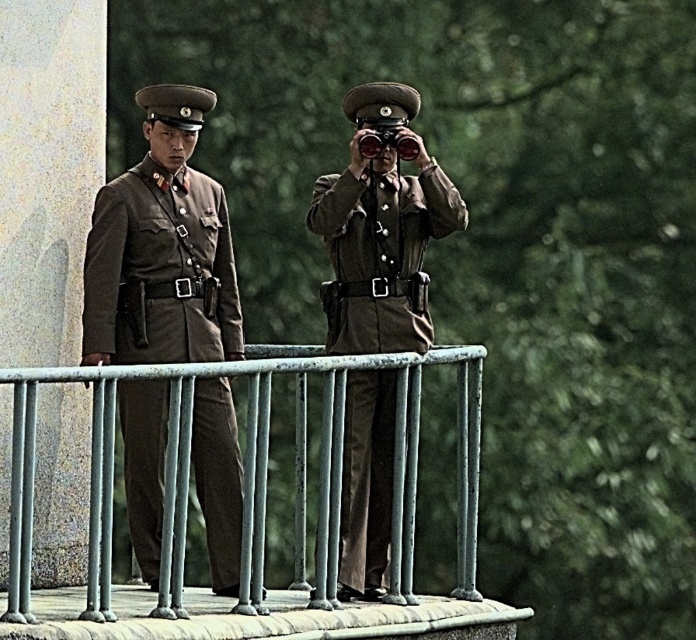
How far apart are metallic gray fence at center and matte brown uniform at center?

metallic gray fence at center is 19.99 feet from matte brown uniform at center.

Does metallic gray fence at center appear on the left side of matte brown uniform at center?

Indeed, metallic gray fence at center is positioned on the left side of matte brown uniform at center.

Between point (251, 404) and point (386, 280), which one is positioned in front?

Point (251, 404)

Locate an element on the screen. The height and width of the screenshot is (640, 696). metallic gray fence at center is located at coordinates (345, 468).

Describe the element at coordinates (159, 269) in the screenshot. I see `matte olive-green uniform at left` at that location.

Which is more to the left, matte olive-green uniform at left or matte brown uniform at center?

From the viewer's perspective, matte olive-green uniform at left appears more on the left side.

Describe the element at coordinates (159, 269) in the screenshot. I see `matte olive-green uniform at left` at that location.

Identify the location of matte olive-green uniform at left. The width and height of the screenshot is (696, 640). (159, 269).

Which is behind, point (106, 429) or point (411, 157)?

Positioned behind is point (411, 157).

Can you confirm if metallic gray fence at center is thinner than matte black binoculars at center?

In fact, metallic gray fence at center might be wider than matte black binoculars at center.

The width and height of the screenshot is (696, 640). I want to click on metallic gray fence at center, so click(345, 468).

The height and width of the screenshot is (640, 696). In order to click on metallic gray fence at center in this screenshot , I will do `click(345, 468)`.